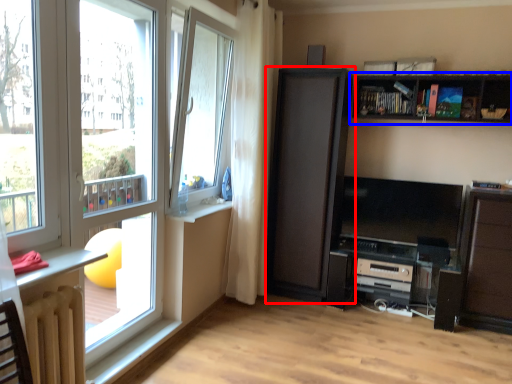
Question: Which of the following is the farthest to the observer, cupboard (highlighted by a red box) or shelf (highlighted by a blue box)?

Choices:
 (A) cupboard
 (B) shelf

Answer: (A)